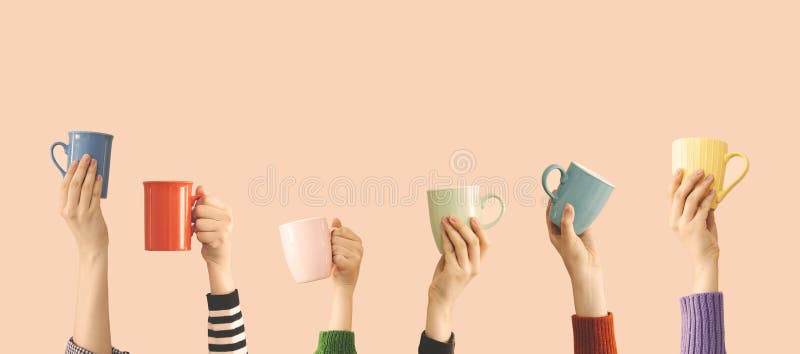
The height and width of the screenshot is (354, 800). Find the location of `mug`. mug is located at coordinates coord(92,144), coord(178,224), coord(310,252), coord(444,204), coord(580,184), coord(702,158).